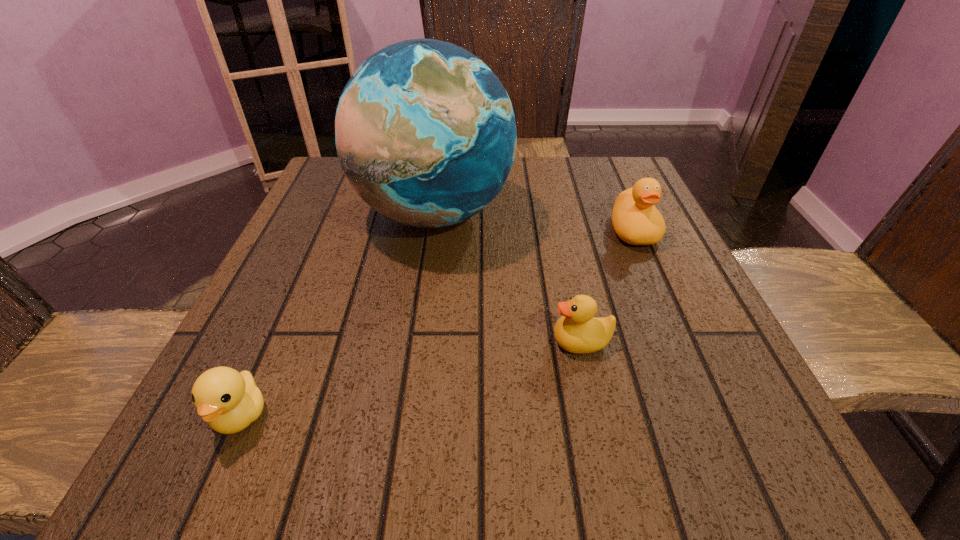
In order to click on free space located at the beak of the second duck from right to left in this screenshot , I will do `click(326, 341)`.

Where is `vacant region located at the beak of the second duck from right to left`? vacant region located at the beak of the second duck from right to left is located at coordinates (x=339, y=341).

Locate an element on the screen. Image resolution: width=960 pixels, height=540 pixels. vacant region located at the beak of the second duck from right to left is located at coordinates (401, 341).

Where is `object that is at the far edge`? The height and width of the screenshot is (540, 960). object that is at the far edge is located at coordinates (425, 132).

You are a GUI agent. You are given a task and a screenshot of the screen. Output one action in this format:
    pyautogui.click(x=<x>, y=<y>)
    Task: Click on the object at the near edge
    
    Given the screenshot: What is the action you would take?
    pyautogui.click(x=229, y=401)

At what (x,y) coordinates should I click in order to perform the action: click on globe that is positioned at the left edge. Please return your answer as a coordinate pair (x, y). This screenshot has height=540, width=960. Looking at the image, I should click on (425, 132).

Where is `duck at the left edge`? The image size is (960, 540). duck at the left edge is located at coordinates (229, 401).

The height and width of the screenshot is (540, 960). Find the location of `object that is positioned at the right edge`. object that is positioned at the right edge is located at coordinates (636, 220).

Where is `object located at the far left corner`? This screenshot has height=540, width=960. object located at the far left corner is located at coordinates coord(425,132).

You are a GUI agent. You are given a task and a screenshot of the screen. Output one action in this format:
    pyautogui.click(x=<x>, y=<y>)
    Task: Click on the object at the near left corner
    The height and width of the screenshot is (540, 960).
    Given the screenshot: What is the action you would take?
    pyautogui.click(x=229, y=401)